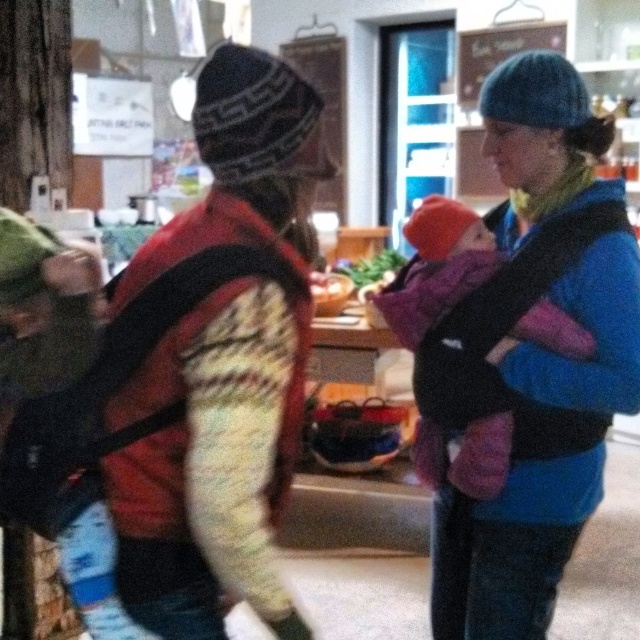
You are at a community event and want to take a photo of the blue knitted hat at upper right and the purple fleece baby carrier at center. Which object should you focus on first if you want to capture both in one frame without moving the camera?

You should focus on the purple fleece baby carrier at center first because the blue knitted hat at upper right is to the right of it, so centering the purple fleece baby carrier will allow both objects to be in the frame.

You are a photographer at the event and want to take a photo that includes both the blue knitted hat at upper right and the purple fleece baby carrier at center. Which object should you focus on first to ensure both are in frame?

You should focus on the blue knitted hat at upper right first because it is in front of the purple fleece baby carrier at center, so adjusting the camera angle to include both would require starting with the foreground object.